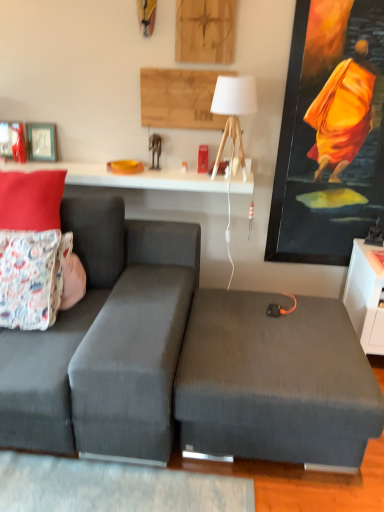
Locate an element on the screen. The height and width of the screenshot is (512, 384). free point above white glossy table at upper center (from a real-world perspective) is located at coordinates (132, 174).